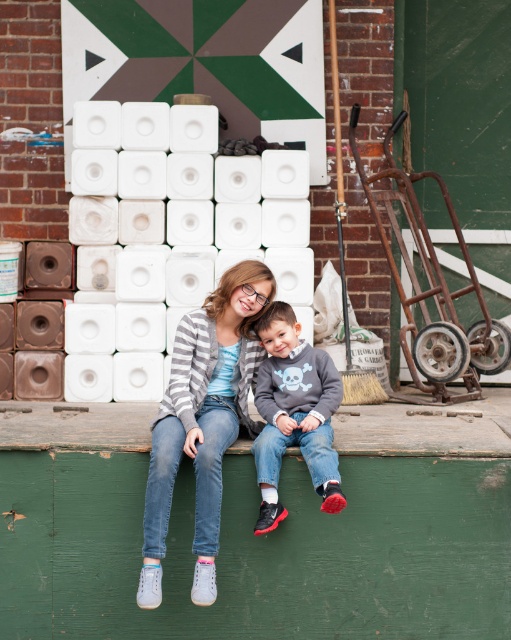
Does point (174, 392) come behind point (278, 365)?

No, it is in front of (278, 365).

Which of these two, matte gray sweater at center or dark gray sweater at center, stands taller?

matte gray sweater at center

Who is more distant from viewer, (243, 410) or (328, 465)?

Positioned behind is point (243, 410).

This screenshot has height=640, width=511. I want to click on matte gray sweater at center, so click(203, 419).

Does green wooden bench at lower center appear over dark gray sweater at center?

Actually, green wooden bench at lower center is below dark gray sweater at center.

From the picture: Measure the distance between point (x=147, y=417) and camera.

A distance of 19.80 feet exists between point (x=147, y=417) and camera.

What do you see at coordinates (425, 428) in the screenshot? I see `green wooden bench at lower center` at bounding box center [425, 428].

In order to click on green wooden bench at lower center in this screenshot , I will do `click(425, 428)`.

Can you confirm if white plastic toilet paper at center is positioned above green wooden bench at lower center?

Correct, white plastic toilet paper at center is located above green wooden bench at lower center.

Does white plastic toilet paper at center have a greater width compared to green wooden bench at lower center?

Yes, white plastic toilet paper at center is wider than green wooden bench at lower center.

The height and width of the screenshot is (640, 511). Describe the element at coordinates (200, 237) in the screenshot. I see `white plastic toilet paper at center` at that location.

Locate an element on the screen. The height and width of the screenshot is (640, 511). white plastic toilet paper at center is located at coordinates click(x=200, y=237).